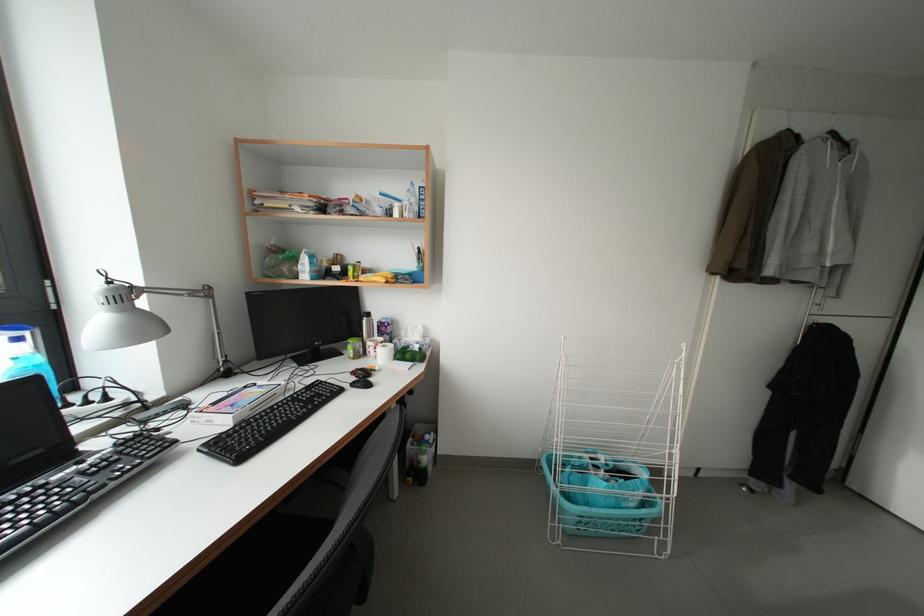
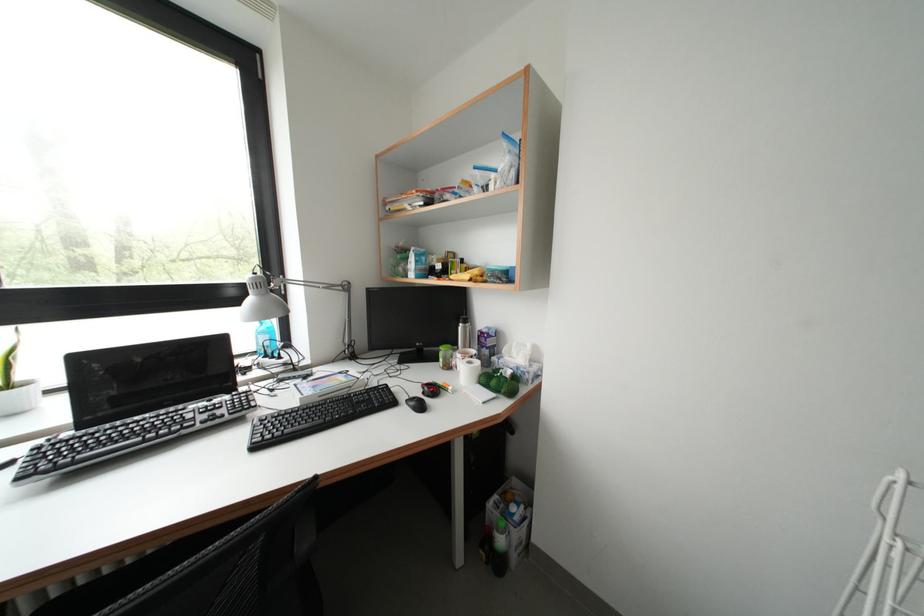
Locate, in the second image, the point that corresponds to (x=415, y=361) in the first image.

(500, 387)